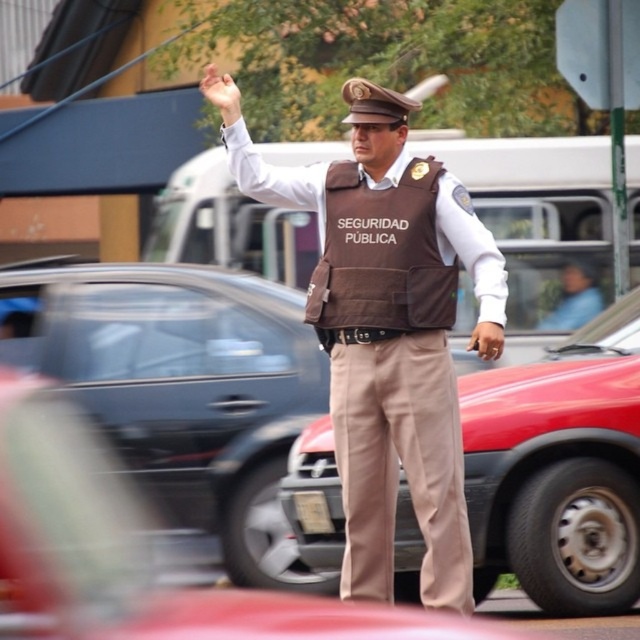
Is brown leather pants at center above brown leather vest at center?

Actually, brown leather pants at center is below brown leather vest at center.

Between brown leather pants at center and brown leather vest at center, which one has more height?

Standing taller between the two is brown leather vest at center.

Image resolution: width=640 pixels, height=640 pixels. What do you see at coordinates (560, 468) in the screenshot? I see `brown leather pants at center` at bounding box center [560, 468].

Locate an element on the screen. The height and width of the screenshot is (640, 640). brown leather pants at center is located at coordinates point(560,468).

Does brown leather vest at center have a greater height compared to brown fabric vest at center?

Correct, brown leather vest at center is much taller as brown fabric vest at center.

Who is positioned more to the right, brown leather vest at center or brown fabric vest at center?

brown leather vest at center

Identify the location of brown leather vest at center. coord(401,460).

Is brown leather pants at center thinner than brown fabric vest at center?

No, brown leather pants at center is not thinner than brown fabric vest at center.

Can you confirm if brown leather pants at center is positioned to the right of brown fabric vest at center?

Yes, brown leather pants at center is to the right of brown fabric vest at center.

Describe the element at coordinates (560, 468) in the screenshot. This screenshot has height=640, width=640. I see `brown leather pants at center` at that location.

Where is `brown leather pants at center`? brown leather pants at center is located at coordinates (560, 468).